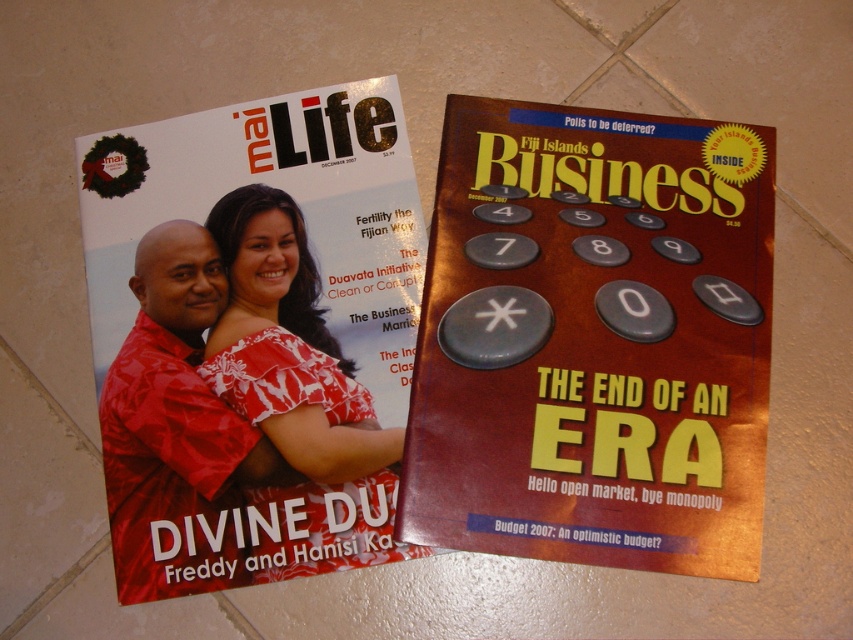
Question: Considering the relative positions of metallic gold magazine at right and white floral dress at center in the image provided, where is metallic gold magazine at right located with respect to white floral dress at center?

Choices:
 (A) right
 (B) left

Answer: (A)

Question: Which of these objects is positioned farthest from the matte red shirt at center?

Choices:
 (A) matte red magazine at upper left
 (B) white floral dress at center
 (C) metallic gold magazine at right

Answer: (C)

Question: Is matte red shirt at center thinner than white floral dress at center?

Choices:
 (A) no
 (B) yes

Answer: (B)

Question: Estimate the real-world distances between objects in this image. Which object is farther from the matte red shirt at center?

Choices:
 (A) matte red magazine at upper left
 (B) white floral dress at center
 (C) metallic gold magazine at right

Answer: (C)

Question: Is the position of metallic gold magazine at right more distant than that of matte red magazine at upper left?

Choices:
 (A) yes
 (B) no

Answer: (B)

Question: Which point is farther to the camera?

Choices:
 (A) (659, 385)
 (B) (347, 528)
 (C) (236, 356)

Answer: (C)